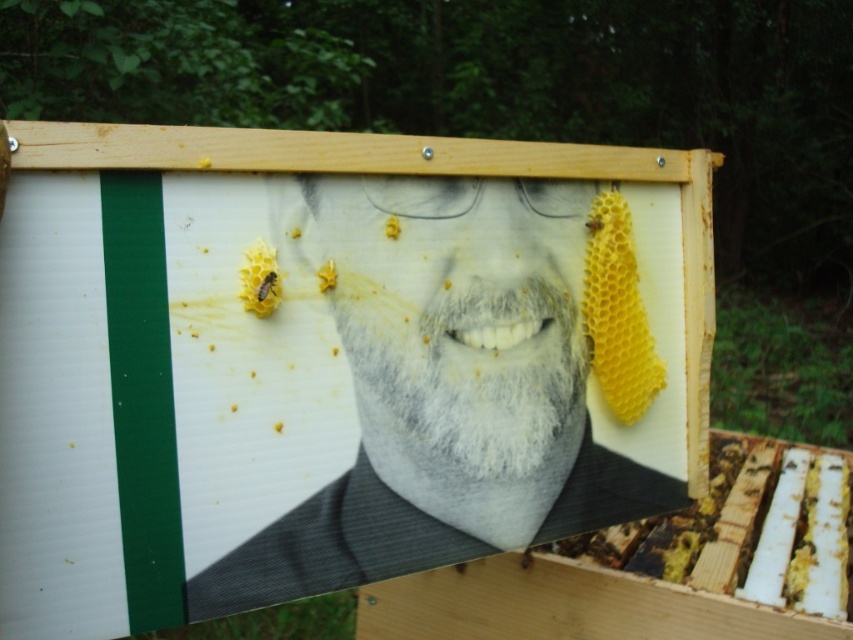
Question: Among these objects, which one is farthest from the camera?

Choices:
 (A) translucent yellow honeycomb at center
 (B) translucent yellow honeycomb at upper center
 (C) gray matte face at center
 (D) gray matte portrait at center

Answer: (A)

Question: Can you confirm if gray matte face at center is positioned to the right of translucent yellow honeycomb at center?

Choices:
 (A) no
 (B) yes

Answer: (B)

Question: Where is gray matte face at center located in relation to translucent yellow honeycomb at center in the image?

Choices:
 (A) right
 (B) left

Answer: (A)

Question: Which point is closer to the camera taking this photo?

Choices:
 (A) (274, 273)
 (B) (325, 285)
 (C) (419, 212)
 (D) (512, 333)

Answer: (A)

Question: Which is nearer to the translucent yellow honeycomb at upper center?

Choices:
 (A) gray matte face at center
 (B) gray matte portrait at center
 (C) translucent yellow honeycomb at center

Answer: (C)

Question: Is gray matte portrait at center smaller than translucent yellow honeycomb at upper center?

Choices:
 (A) no
 (B) yes

Answer: (A)